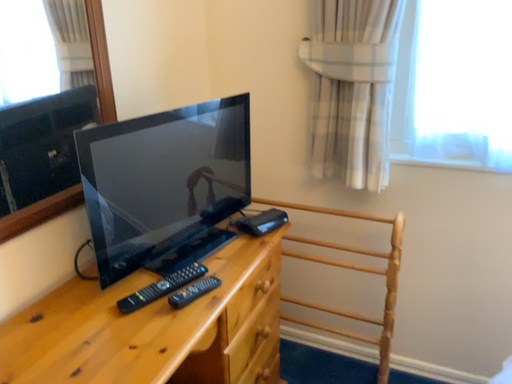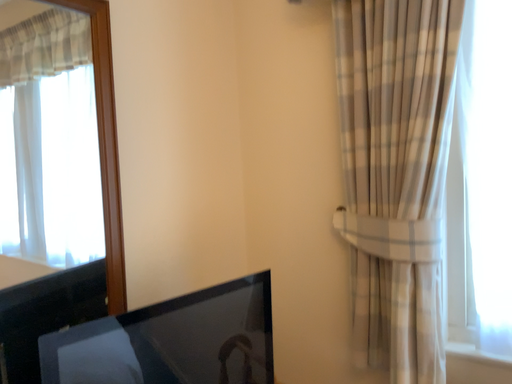
Question: Which way did the camera rotate in the video?

Choices:
 (A) rotated downward
 (B) rotated upward

Answer: (B)